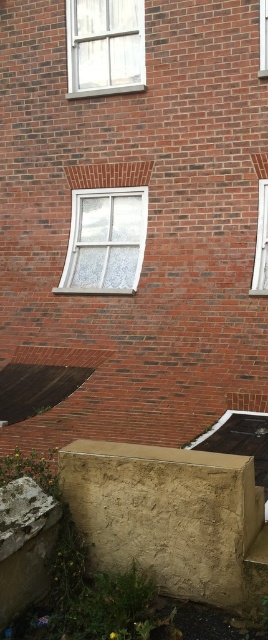
Who is more forward, [94,259] or [265,208]?

Point [265,208]

Based on the photo, which is more to the right, white frosted glass window at center or white glass window at right?

Positioned to the right is white glass window at right.

Who is more forward, (94,273) or (258,285)?

Positioned in front is point (258,285).

Identify the location of white frosted glass window at center. The height and width of the screenshot is (640, 268). (105, 241).

Does white painted wood window at upper left have a greater width compared to white glass window at right?

Correct, the width of white painted wood window at upper left exceeds that of white glass window at right.

From the picture: Can you confirm if white painted wood window at upper left is shorter than white glass window at right?

In fact, white painted wood window at upper left may be taller than white glass window at right.

Which is behind, point (123, 81) or point (265, 252)?

Point (123, 81)

The image size is (268, 640). I want to click on white painted wood window at upper left, so click(105, 45).

Is white frosted glass window at center shorter than clear glass window at upper right?

Incorrect, white frosted glass window at center's height does not fall short of clear glass window at upper right's.

Find the location of `white frosted glass window at center`. white frosted glass window at center is located at coordinates (105, 241).

Image resolution: width=268 pixels, height=640 pixels. Identify the location of white frosted glass window at center. (105, 241).